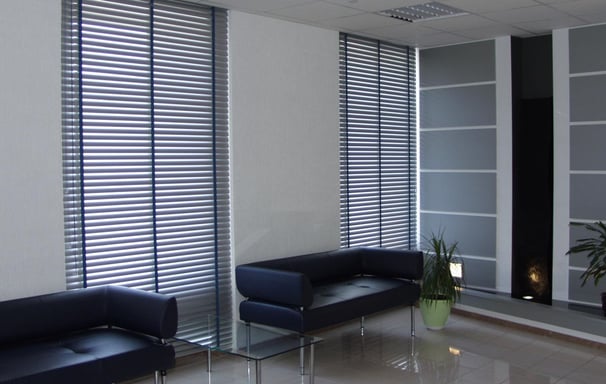
At what (x,y) coordinates should I click in order to perform the action: click on floor. Please return your answer as a coordinate pair (x, y). This screenshot has width=606, height=384. Looking at the image, I should click on (462, 360).